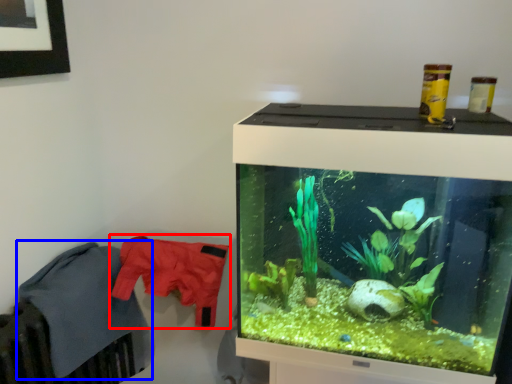
Question: Which object appears closest to the camera in this image, clothing (highlighted by a red box) or clothing (highlighted by a blue box)?

Choices:
 (A) clothing
 (B) clothing

Answer: (B)